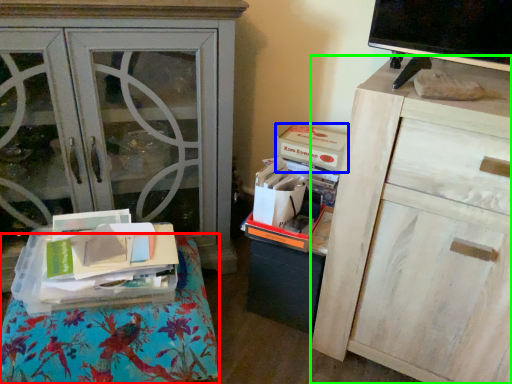
Question: Based on their relative distances, which object is nearer to furniture (highlighted by a red box)? Choose from storage box (highlighted by a blue box) and chest of drawers (highlighted by a green box).

Choices:
 (A) storage box
 (B) chest of drawers

Answer: (B)